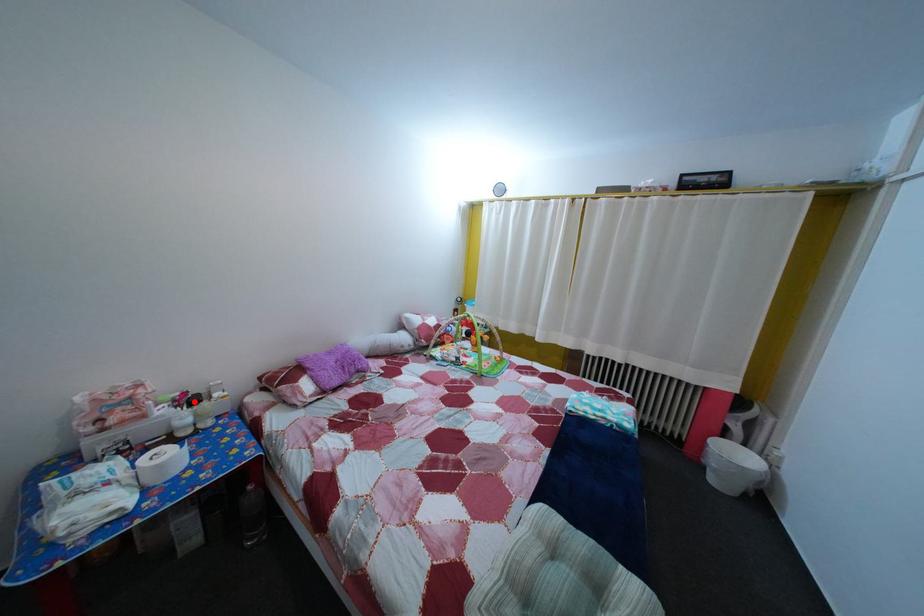
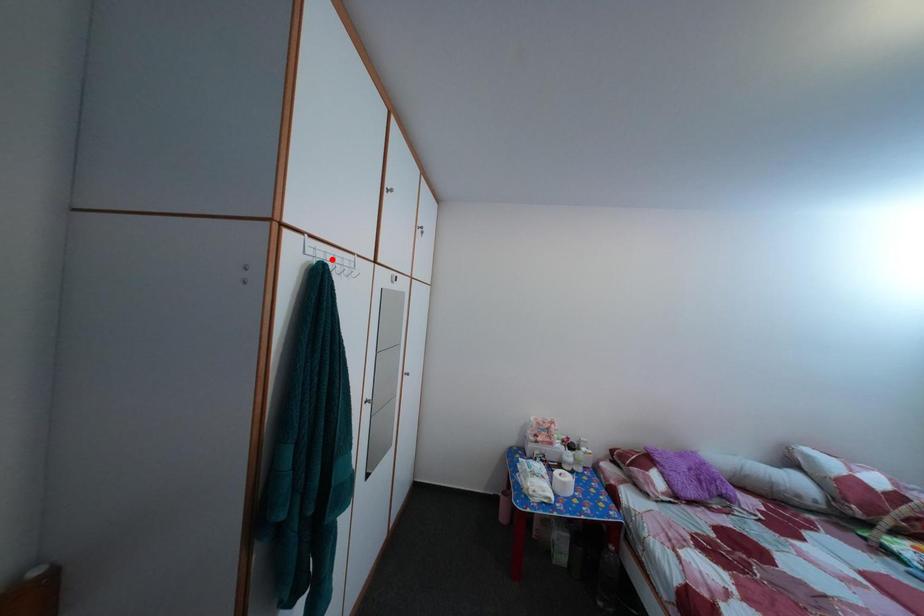
I am providing you with two images of the same scene from different viewpoints. A red point is marked on the first image and another point is marked on the second image. Does the point marked in image1 correspond to the same location as the one in image2?

No